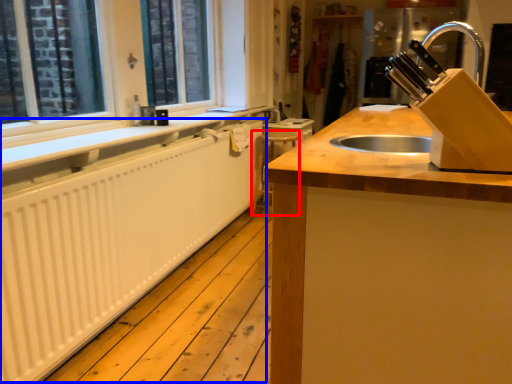
Question: Which point is further to the camera, step stool (highlighted by a red box) or radiator (highlighted by a blue box)?

Choices:
 (A) step stool
 (B) radiator

Answer: (A)